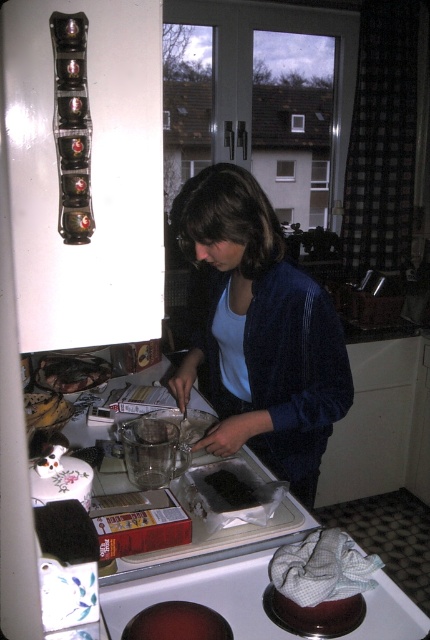
Does dark brown cake at lower center appear over dark matte chocolate at center?

No, dark brown cake at lower center is not above dark matte chocolate at center.

Looking at this image, who is more distant from viewer, [214,637] or [239,468]?

Point [239,468]

Locate an element on the screen. The image size is (430, 640). dark brown cake at lower center is located at coordinates (177, 621).

Who is shorter, blue velvety jacket at center or brown crumbly cake at lower left?

With less height is brown crumbly cake at lower left.

Can you confirm if blue velvety jacket at center is positioned below brown crumbly cake at lower left?

No, blue velvety jacket at center is not below brown crumbly cake at lower left.

Who is more distant from viewer, (316, 348) or (45, 388)?

Positioned behind is point (45, 388).

Where is `blue velvety jacket at center`? The width and height of the screenshot is (430, 640). blue velvety jacket at center is located at coordinates (260, 332).

Does point (172, 620) come in front of point (92, 369)?

Yes, it is in front of point (92, 369).

Is dark brown cake at lower center closer to the viewer compared to brown crumbly cake at lower left?

Yes, it is.

At what (x,y) coordinates should I click in order to perform the action: click on dark brown cake at lower center. Please return your answer as a coordinate pair (x, y). Looking at the image, I should click on (177, 621).